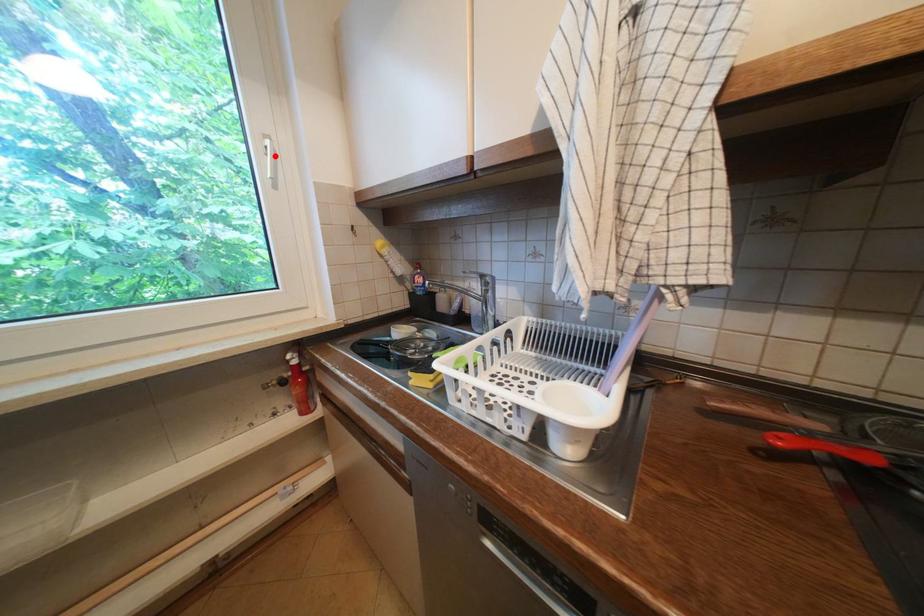
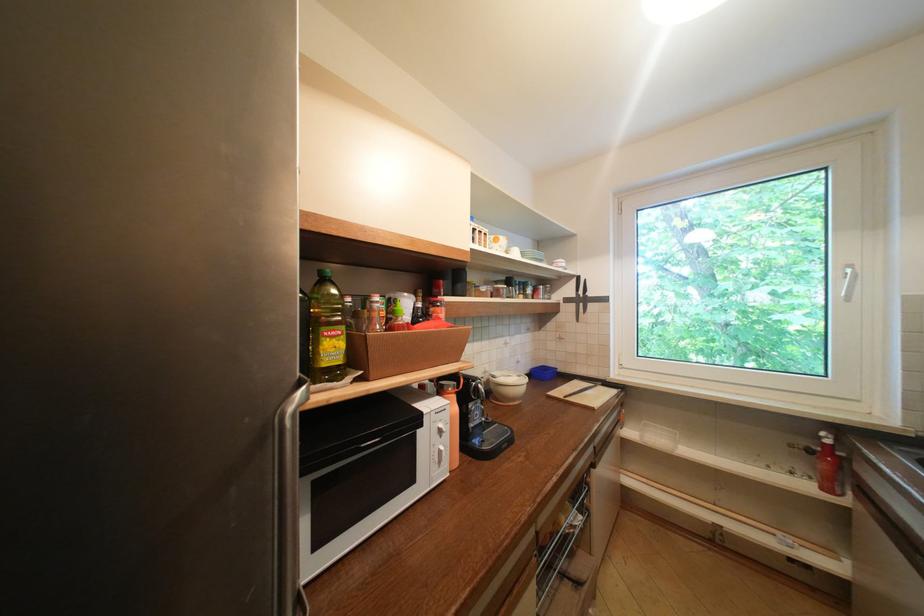
Find the pixel in the second image that matches the highlighted location in the first image.

(854, 280)